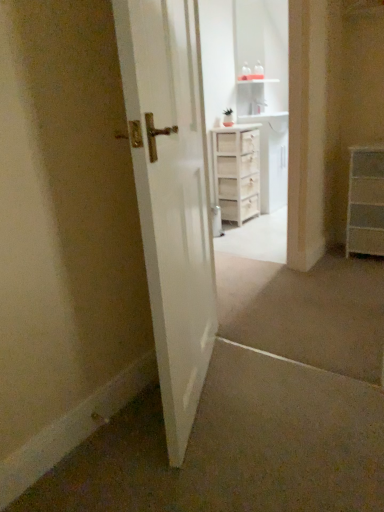
Question: Is white glossy door at center surrounding white wood cabinet at center?

Choices:
 (A) no
 (B) yes

Answer: (A)

Question: Is white glossy door at center completely or partially outside of white wood cabinet at center?

Choices:
 (A) yes
 (B) no

Answer: (A)

Question: Is white glossy door at center next to white wood cabinet at center and touching it?

Choices:
 (A) no
 (B) yes

Answer: (A)

Question: From a real-world perspective, is white glossy door at center beneath white wood cabinet at center?

Choices:
 (A) yes
 (B) no

Answer: (B)

Question: Considering the relative sizes of white glossy door at center and white wood cabinet at center in the image provided, is white glossy door at center shorter than white wood cabinet at center?

Choices:
 (A) no
 (B) yes

Answer: (A)

Question: Does white glossy door at center appear on the right side of white wood cabinet at center?

Choices:
 (A) no
 (B) yes

Answer: (A)

Question: Considering the relative sizes of white wood cabinet at upper center and white wooden chest of drawers at center, which is the first chest of drawers from back to front, in the image provided, is white wood cabinet at upper center shorter than white wooden chest of drawers at center, which is the first chest of drawers from back to front,?

Choices:
 (A) no
 (B) yes

Answer: (A)

Question: Is the position of white wood cabinet at upper center more distant than that of white wooden chest of drawers at center, which is the first chest of drawers from back to front?

Choices:
 (A) yes
 (B) no

Answer: (B)

Question: Is white wood cabinet at upper center at the right side of white wooden chest of drawers at center, acting as the second chest of drawers starting from the right?

Choices:
 (A) yes
 (B) no

Answer: (B)

Question: Is white wood cabinet at upper center positioned before white wooden chest of drawers at center, acting as the second chest of drawers starting from the right?

Choices:
 (A) no
 (B) yes

Answer: (B)

Question: Is there a large distance between white wood cabinet at upper center and white wooden chest of drawers at center, which is the first chest of drawers from back to front?

Choices:
 (A) yes
 (B) no

Answer: (B)

Question: From the image's perspective, is white wood cabinet at upper center located beneath white wooden chest of drawers at center, which is the first chest of drawers from back to front?

Choices:
 (A) no
 (B) yes

Answer: (B)

Question: Could you tell me if white wooden chest of drawers at center, which is the first chest of drawers in left-to-right order, is facing white wood cabinet at center?

Choices:
 (A) no
 (B) yes

Answer: (A)